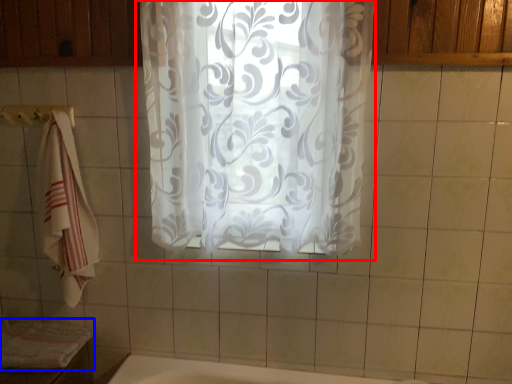
Question: Which of the following is the closest to the observer, curtain (highlighted by a red box) or bath towel (highlighted by a blue box)?

Choices:
 (A) curtain
 (B) bath towel

Answer: (A)